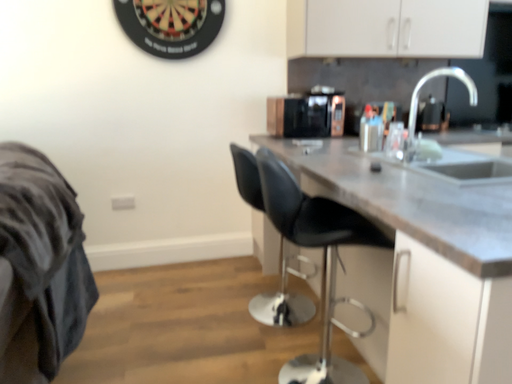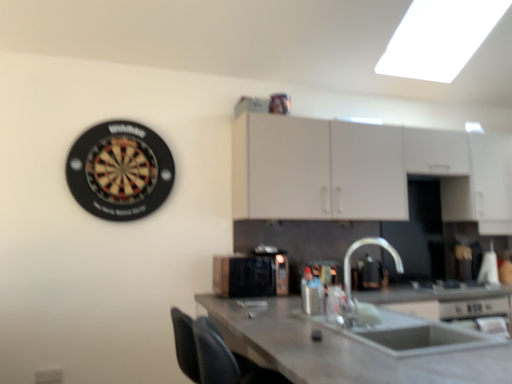
Question: Which way did the camera rotate in the video?

Choices:
 (A) rotated downward
 (B) rotated upward

Answer: (B)